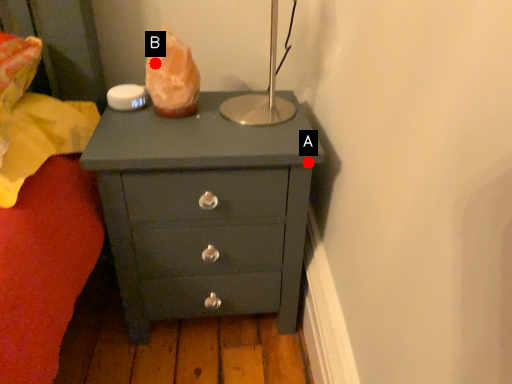
Question: Two points are circled on the image, labeled by A and B beside each circle. Which of the following is the farthest from the observer?

Choices:
 (A) A is further
 (B) B is further

Answer: (B)